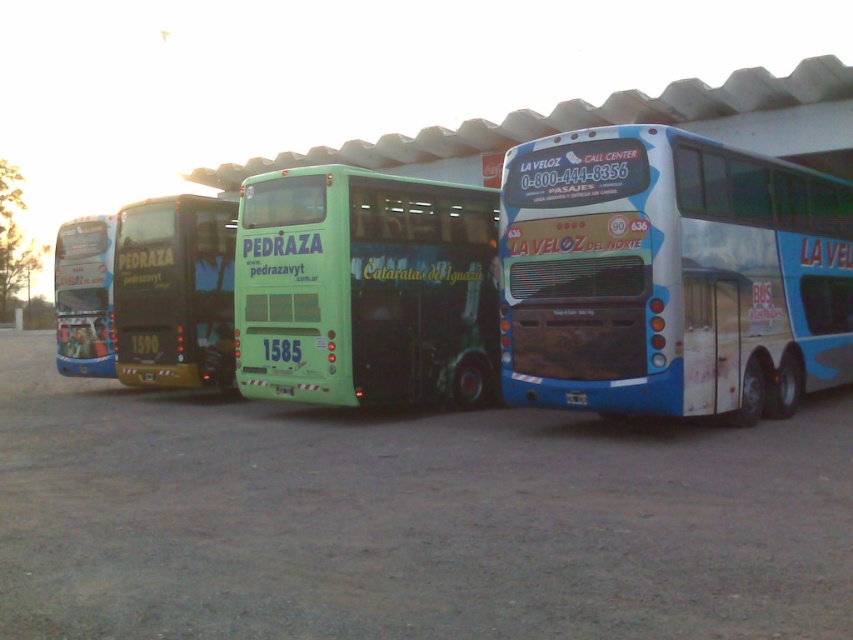
Looking at this image, between metallic gold bus at center and matte blue bus at left, which one is positioned higher?

Positioned higher is metallic gold bus at center.

Can you confirm if metallic gold bus at center is taller than matte blue bus at left?

No, metallic gold bus at center is not taller than matte blue bus at left.

Which is behind, point (122, 282) or point (80, 227)?

The point (80, 227) is behind.

What are the coordinates of `metallic gold bus at center` in the screenshot? It's located at (173, 292).

Which is more to the right, blue painted bus at right or metallic gold bus at center?

blue painted bus at right is more to the right.

Who is more distant from viewer, (x=704, y=220) or (x=206, y=323)?

The point (x=206, y=323) is behind.

This screenshot has width=853, height=640. In order to click on blue painted bus at right in this screenshot , I will do `click(670, 275)`.

Is blue painted bus at right thinner than green matte bus at center?

Correct, blue painted bus at right's width is less than green matte bus at center's.

Identify the location of blue painted bus at right. (670, 275).